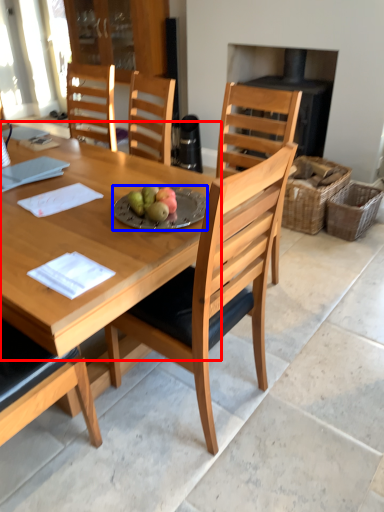
Question: Which of the following is the closest to the observer, round table (highlighted by a red box) or plate (highlighted by a blue box)?

Choices:
 (A) round table
 (B) plate

Answer: (A)